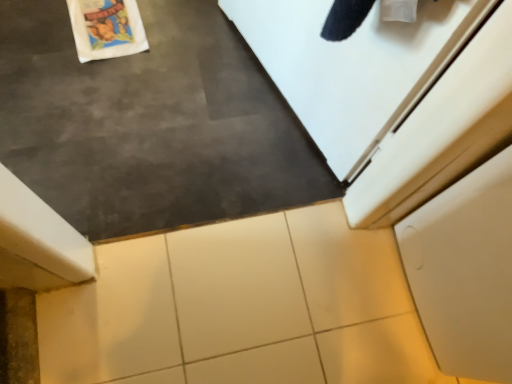
Question: Are slate at center and white glossy tile at center far apart?

Choices:
 (A) yes
 (B) no

Answer: (B)

Question: From a real-world perspective, does slate at center sit lower than white glossy tile at center?

Choices:
 (A) yes
 (B) no

Answer: (B)

Question: From the image's perspective, is slate at center over white glossy tile at center?

Choices:
 (A) yes
 (B) no

Answer: (A)

Question: Considering the relative positions of slate at center and white glossy tile at center in the image provided, is slate at center in front of white glossy tile at center?

Choices:
 (A) yes
 (B) no

Answer: (A)

Question: Is slate at center smaller than white glossy tile at center?

Choices:
 (A) no
 (B) yes

Answer: (A)

Question: Is white glossy tile at center at the back of slate at center?

Choices:
 (A) yes
 (B) no

Answer: (B)

Question: From the image's perspective, is white tile at center above white glossy tile at center?

Choices:
 (A) yes
 (B) no

Answer: (B)

Question: From the image's perspective, is white tile at center located beneath white glossy tile at center?

Choices:
 (A) yes
 (B) no

Answer: (A)

Question: Is white tile at center oriented away from white glossy tile at center?

Choices:
 (A) no
 (B) yes

Answer: (A)

Question: From a real-world perspective, is white tile at center located higher than white glossy tile at center?

Choices:
 (A) yes
 (B) no

Answer: (A)

Question: Is white glossy tile at center located within white tile at center?

Choices:
 (A) yes
 (B) no

Answer: (B)

Question: From a real-world perspective, does white tile at center sit lower than white glossy tile at center?

Choices:
 (A) no
 (B) yes

Answer: (A)

Question: Considering the relative sizes of white tile at center and white matte cabinet at lower right in the image provided, is white tile at center shorter than white matte cabinet at lower right?

Choices:
 (A) no
 (B) yes

Answer: (B)